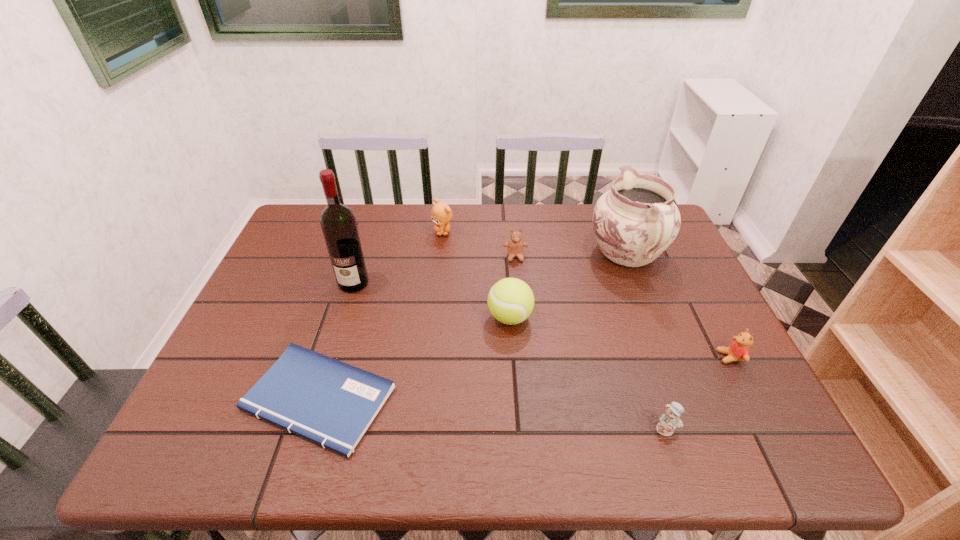
Where is `vacant space at the left edge of the desktop`? vacant space at the left edge of the desktop is located at coordinates (309, 275).

At what (x,y) coordinates should I click in order to perform the action: click on free space at the right edge of the desktop. Please return your answer as a coordinate pair (x, y). The image size is (960, 540). Looking at the image, I should click on (677, 324).

Where is `free space between the pitcher and the second nearest teddy bear`? The width and height of the screenshot is (960, 540). free space between the pitcher and the second nearest teddy bear is located at coordinates click(679, 306).

Identify the location of free space between the third teddy bear from left to right and the paperback book. (492, 414).

Where is `free space between the third nearest teddy bear and the pitcher`? The width and height of the screenshot is (960, 540). free space between the third nearest teddy bear and the pitcher is located at coordinates (571, 256).

Find the location of `free point between the sixth object from right to left and the tallest object`. free point between the sixth object from right to left and the tallest object is located at coordinates (398, 258).

Image resolution: width=960 pixels, height=540 pixels. In order to click on vacant area between the second teddy bear from left to right and the pitcher in this screenshot , I will do `click(571, 256)`.

Identify the location of free spot between the nearest teddy bear and the seventh shortest object. click(x=647, y=342).

Identify the location of vacant space that's between the fifth farthest object and the second teddy bear from right to left. point(588,373).

Where is `empty space between the tallest object and the tennis ball`? empty space between the tallest object and the tennis ball is located at coordinates (432, 300).